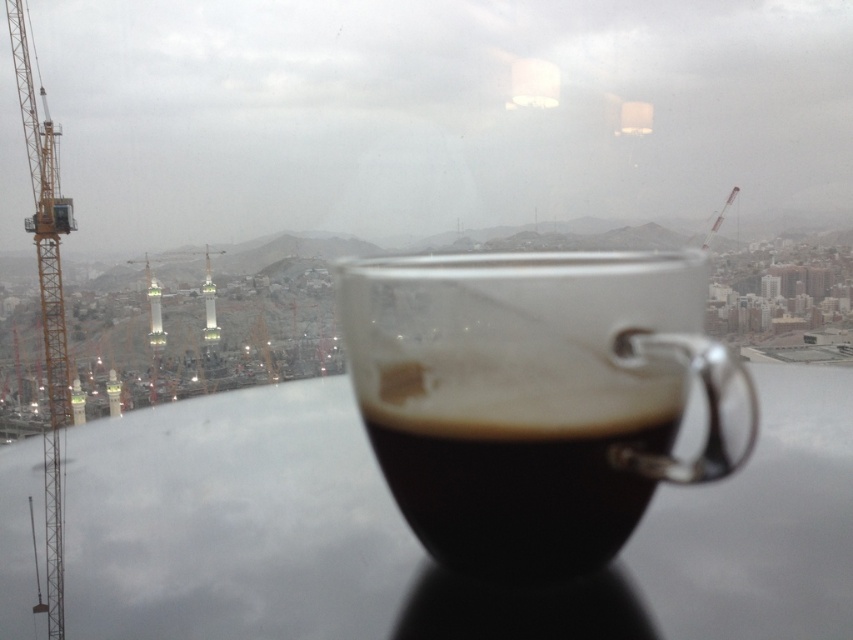
Question: Does black matte cup at center appear on the right side of yellow metallic crane at left?

Choices:
 (A) no
 (B) yes

Answer: (B)

Question: Which point is closer to the camera?

Choices:
 (A) yellow metallic crane at left
 (B) black matte cup at center

Answer: (B)

Question: Which point is farther from the camera taking this photo?

Choices:
 (A) (552, 385)
 (B) (57, 513)

Answer: (B)

Question: Can you confirm if black matte cup at center is positioned above yellow metallic crane at left?

Choices:
 (A) yes
 (B) no

Answer: (B)

Question: Among these objects, which one is farthest from the camera?

Choices:
 (A) yellow metallic crane at left
 (B) black matte cup at center

Answer: (A)

Question: Is black matte cup at center positioned before yellow metallic crane at left?

Choices:
 (A) yes
 (B) no

Answer: (A)